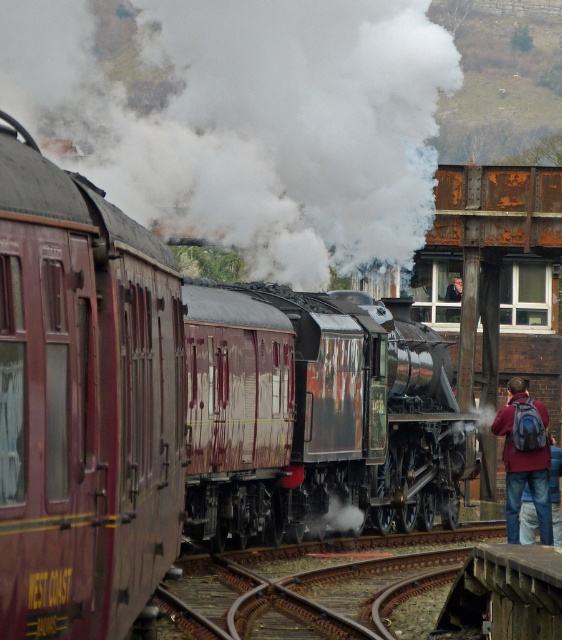
Does maroon polished wood train at center have a greater width compared to maroon polished wood passenger train at left?

Correct, the width of maroon polished wood train at center exceeds that of maroon polished wood passenger train at left.

Which of these two, maroon polished wood train at center or maroon polished wood passenger train at left, stands taller?

Standing taller between the two is maroon polished wood train at center.

Is point (146, 509) farther from camera compared to point (52, 545)?

Yes, point (146, 509) is farther from viewer.

The width and height of the screenshot is (562, 640). I want to click on maroon polished wood train at center, so click(179, 406).

Which is above, white vapor at center or denim jacket at lower right?

Positioned higher is white vapor at center.

Find the location of a particular element. This screenshot has width=562, height=640. white vapor at center is located at coordinates (251, 122).

Consider the image. Is white vapor at center smaller than maroon polished wood passenger train at left?

Actually, white vapor at center might be larger than maroon polished wood passenger train at left.

Is white vapor at center above maroon polished wood passenger train at left?

Correct, white vapor at center is located above maroon polished wood passenger train at left.

Is point (71, 58) more distant than point (165, 280)?

Yes.

Locate an element on the screen. This screenshot has width=562, height=640. white vapor at center is located at coordinates (251, 122).